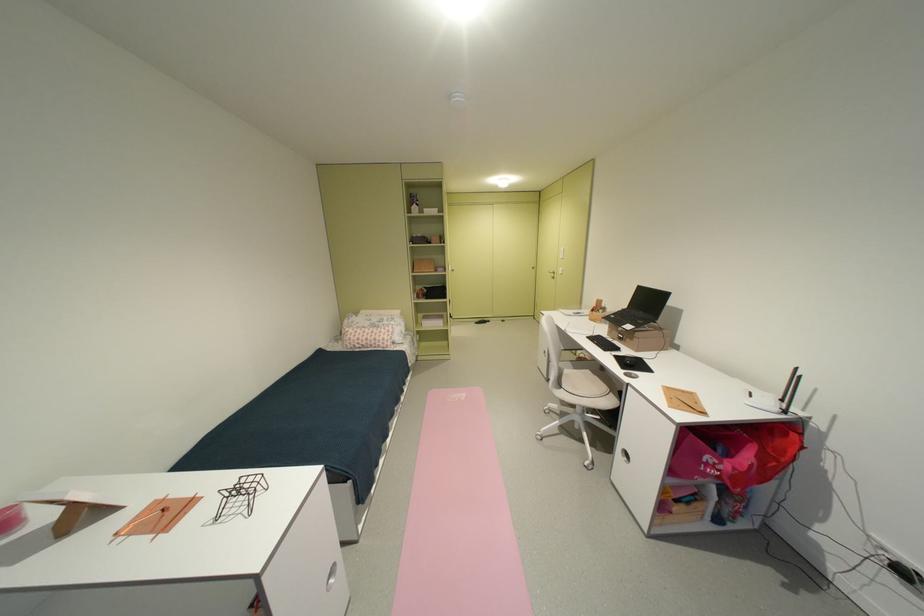
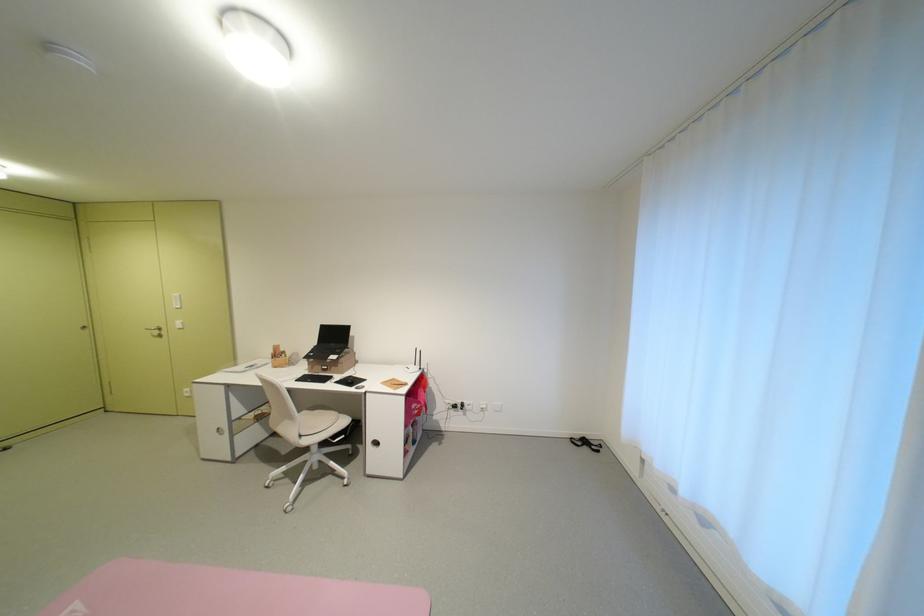
Find the pixel in the second image that matches point (554, 357) in the first image.

(232, 435)